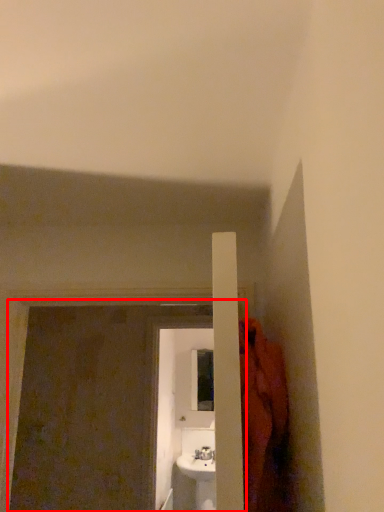
Question: In this image, where is screen door (annotated by the red box) located relative to screen door?

Choices:
 (A) left
 (B) right

Answer: (A)